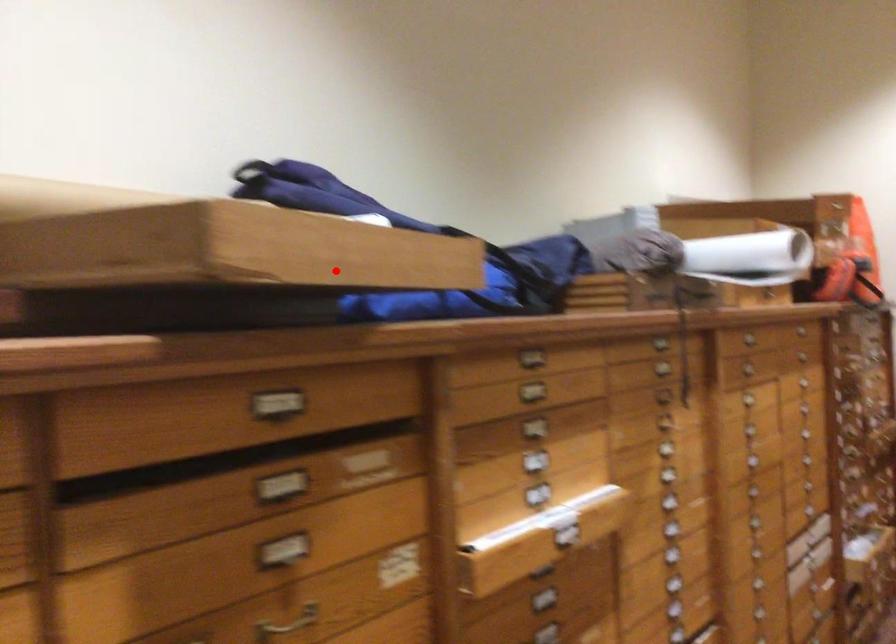
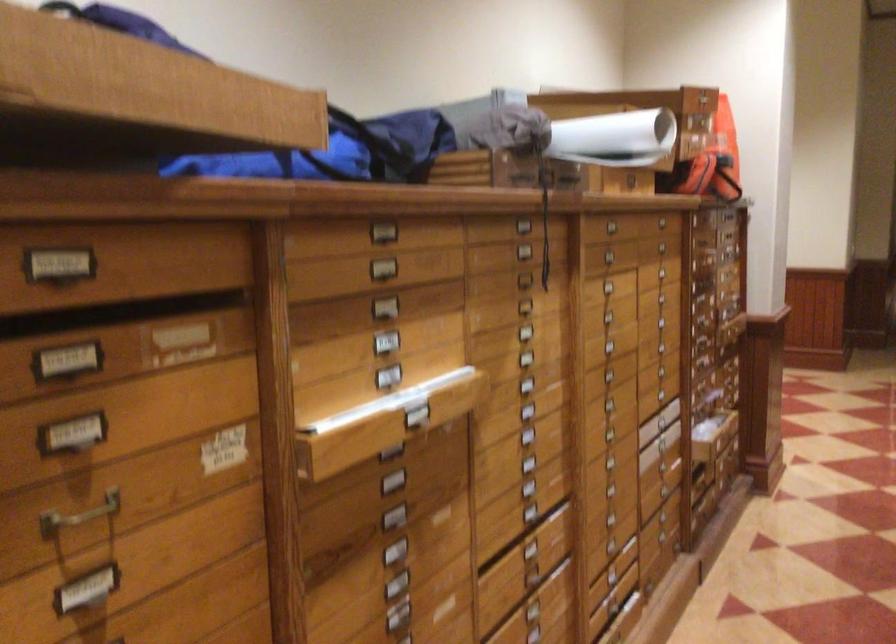
In the second image, find the point that corresponds to the highlighted location in the first image.

(135, 95)